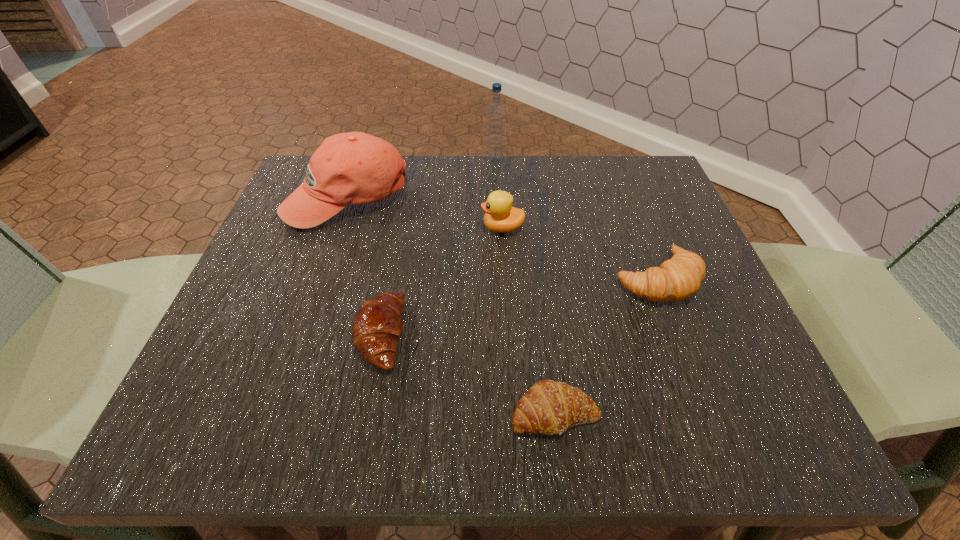
The height and width of the screenshot is (540, 960). What are the coordinates of `water bottle` in the screenshot? It's located at (496, 114).

The height and width of the screenshot is (540, 960). Identify the location of the tallest object. (496, 114).

Identify the location of baseball cap. (348, 168).

Identify the location of the fourth shortest object. (500, 216).

Locate an element on the screen. The height and width of the screenshot is (540, 960). the tallest crescent roll is located at coordinates (678, 278).

Where is `the rightmost object`? Image resolution: width=960 pixels, height=540 pixels. the rightmost object is located at coordinates (678, 278).

Locate an element on the screen. Image resolution: width=960 pixels, height=540 pixels. the leftmost crescent roll is located at coordinates (377, 326).

Where is `the nearest object`? The width and height of the screenshot is (960, 540). the nearest object is located at coordinates (548, 407).

Where is `the second crescent roll from left to right`? Image resolution: width=960 pixels, height=540 pixels. the second crescent roll from left to right is located at coordinates (548, 407).

The width and height of the screenshot is (960, 540). What are the coordinates of `free location located on the right of the tallest object` in the screenshot? It's located at (563, 160).